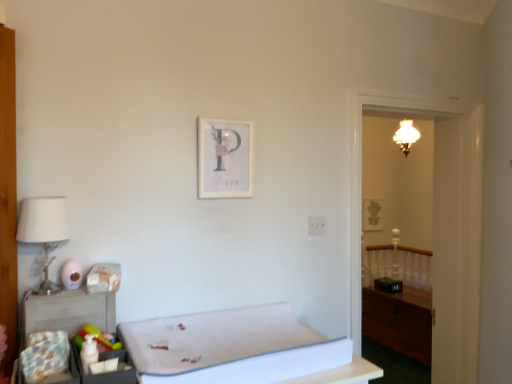
In order to face matte white lampshade at upper right, should I rotate leftwards or rightwards?

A 19.614 degree turn to the right will do.

Locate an element on the screen. This screenshot has width=512, height=384. dark wood vanity at right is located at coordinates (400, 321).

Measure the distance between point (378, 219) and camera.

5.62 meters.

Where is `wooden chest at right`? This screenshot has height=384, width=512. wooden chest at right is located at coordinates (435, 224).

Find the location of a particular element. This screenshot has height=384, width=512. matte white lampshade at upper right is located at coordinates (406, 136).

Can you tell me how much matte paper picture frame at upper center, which is the second picture frame from right to left, and wooden chest at right differ in facing direction?

0.103 degrees.

From the image's perspective, is matte paper picture frame at upper center, which is counted as the 2th picture frame, starting from the bottom, located above or below wooden chest at right?

matte paper picture frame at upper center, which is counted as the 2th picture frame, starting from the bottom, is situated higher than wooden chest at right in the image.

Is matte paper picture frame at upper center, the first picture frame positioned from the top, located outside wooden chest at right?

Absolutely, matte paper picture frame at upper center, the first picture frame positioned from the top, is external to wooden chest at right.

Is wooden chest at right wider or thinner than wooden table at lower left?

Considering their sizes, wooden chest at right looks broader than wooden table at lower left.

From the image's perspective, is wooden chest at right on wooden table at lower left?

Indeed, from the image's perspective, wooden chest at right is shown above wooden table at lower left.

Could you tell me if wooden chest at right is turned towards wooden table at lower left?

No, wooden chest at right is not aimed at wooden table at lower left.

Is wooden chest at right in front of or behind wooden table at lower left in the image?

In the image, wooden chest at right appears behind wooden table at lower left.

Is dark wood vanity at right spatially inside matte white lampshade at upper right, or outside of it?

dark wood vanity at right lies outside matte white lampshade at upper right.

Considering the relative sizes of dark wood vanity at right and matte white lampshade at upper right in the image provided, is dark wood vanity at right thinner than matte white lampshade at upper right?

In fact, dark wood vanity at right might be wider than matte white lampshade at upper right.

Where is `vanity below the matte white lampshade at upper right (from a real-world perspective)`? vanity below the matte white lampshade at upper right (from a real-world perspective) is located at coordinates (400, 321).

Can you confirm if matte white lampshade at upper right is thinner than wooden table at lower left?

No.

Based on the photo, from a real-world perspective, between matte white lampshade at upper right and wooden table at lower left, who is vertically lower?

From a 3D spatial view, wooden table at lower left is below.

Image resolution: width=512 pixels, height=384 pixels. I want to click on table below the matte white lampshade at upper right (from the image's perspective), so click(67, 312).

Consider the image. What's the angular difference between matte white lampshade at upper right and wooden table at lower left's facing directions?

They differ by 0.864 degrees in their facing directions.

Could you measure the distance between matte white lampshade at upper right and wooden picture frame at right, the second picture frame when ordered from left to right?

matte white lampshade at upper right and wooden picture frame at right, the second picture frame when ordered from left to right, are 3.94 feet apart.

Is matte white lampshade at upper right oriented towards wooden picture frame at right, the 2th picture frame positioned from the front?

No, matte white lampshade at upper right is not aimed at wooden picture frame at right, the 2th picture frame positioned from the front.

From the image's perspective, is matte white lampshade at upper right located above wooden picture frame at right, marked as the 1th picture frame in a right-to-left arrangement?

Correct, matte white lampshade at upper right appears higher than wooden picture frame at right, marked as the 1th picture frame in a right-to-left arrangement, in the image.

Are matte white lampshade at upper right and wooden picture frame at right, marked as the 1th picture frame in a right-to-left arrangement, making contact?

No, matte white lampshade at upper right is not with wooden picture frame at right, marked as the 1th picture frame in a right-to-left arrangement.

Does matte white lampshade at upper right have a larger size compared to white foam mattress at lower center?

Actually, matte white lampshade at upper right might be smaller than white foam mattress at lower center.

Considering the points (406, 136) and (257, 350), which point is behind, point (406, 136) or point (257, 350)?

The point (406, 136) is behind.

At what (x,y) coordinates should I click in order to perform the action: click on furniture below the matte white lampshade at upper right (from a real-world perspective). Please return your answer as a coordinate pair (x, y). Looking at the image, I should click on (238, 349).

Can you confirm if matte white lampshade at upper right is shorter than white foam mattress at lower center?

No, matte white lampshade at upper right is not shorter than white foam mattress at lower center.

Who is more distant, wooden table at lower left or white fabric lampshade at left?

wooden table at lower left is further away from the camera.

Between wooden table at lower left and white fabric lampshade at left, which one has less height?

wooden table at lower left.

From a real-world perspective, which is physically above, wooden table at lower left or white fabric lampshade at left?

white fabric lampshade at left, from a real-world perspective.

Would you say wooden table at lower left is outside white fabric lampshade at left?

Yes.

Where is `window lying behind the matte paper picture frame at upper center, which is the second picture frame from right to left`? This screenshot has height=384, width=512. window lying behind the matte paper picture frame at upper center, which is the second picture frame from right to left is located at coordinates coord(435,224).

Where is `table lying below the wooden chest at right (from the image's perspective)`? The height and width of the screenshot is (384, 512). table lying below the wooden chest at right (from the image's perspective) is located at coordinates (67, 312).

Which object lies nearer to the anchor point wooden armoire at left, wooden table at lower left or wooden chest at right?

wooden table at lower left lies closer to wooden armoire at left than the other object.

Looking at the image, which one is located further to wooden table at lower left, wooden chest at right or wooden picture frame at right, the first picture frame positioned from the bottom?

wooden picture frame at right, the first picture frame positioned from the bottom, is positioned further to the anchor wooden table at lower left.

Considering their positions, is wooden picture frame at right, marked as the 1th picture frame in a right-to-left arrangement, positioned further to white fabric lampshade at left than wooden chest at right?

Among the two, wooden picture frame at right, marked as the 1th picture frame in a right-to-left arrangement, is located further to white fabric lampshade at left.

Considering their positions, is matte white lampshade at upper right positioned closer to white foam mattress at lower center than wooden table at lower left?

wooden table at lower left.

From the image, which object appears to be farther from wooden table at lower left, white fabric lampshade at left or wooden chest at right?

wooden chest at right lies further to wooden table at lower left than the other object.

Looking at the image, which one is located closer to matte white lampshade at upper right, wooden armoire at left or white fabric lampshade at left?

Among the two, white fabric lampshade at left is located nearer to matte white lampshade at upper right.

Which object lies further to the anchor point white foam mattress at lower center, white fabric lampshade at left or matte paper picture frame at upper center, the first picture frame positioned from the top?

Among the two, matte paper picture frame at upper center, the first picture frame positioned from the top, is located further to white foam mattress at lower center.

Looking at the image, which one is located further to wooden armoire at left, matte paper picture frame at upper center, which is the second picture frame from right to left, or matte white lampshade at upper right?

matte white lampshade at upper right lies further to wooden armoire at left than the other object.

The width and height of the screenshot is (512, 384). Identify the location of vanity between white foam mattress at lower center and wooden picture frame at right, marked as the 2th picture frame in a top-to-bottom arrangement, along the z-axis. (400, 321).

Where is `picture frame between wooden armoire at left and dark wood vanity at right in the front-back direction`? The image size is (512, 384). picture frame between wooden armoire at left and dark wood vanity at right in the front-back direction is located at coordinates (225, 158).

Locate an element on the screen. The image size is (512, 384). window between wooden table at lower left and dark wood vanity at right from front to back is located at coordinates (435, 224).

Find the location of `window positioned between wooden armoire at left and dark wood vanity at right from near to far`. window positioned between wooden armoire at left and dark wood vanity at right from near to far is located at coordinates (435, 224).